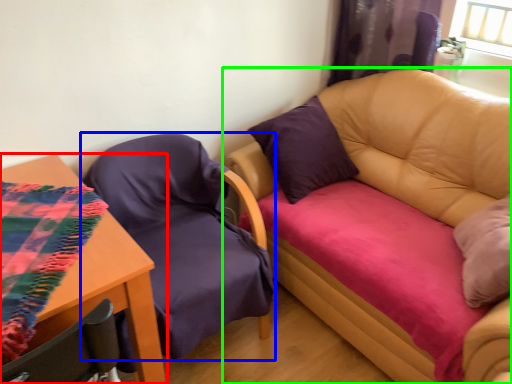
Question: Which object is the farthest from table (highlighted by a red box)? Choose among these: chair (highlighted by a blue box) or studio couch (highlighted by a green box).

Choices:
 (A) chair
 (B) studio couch

Answer: (B)